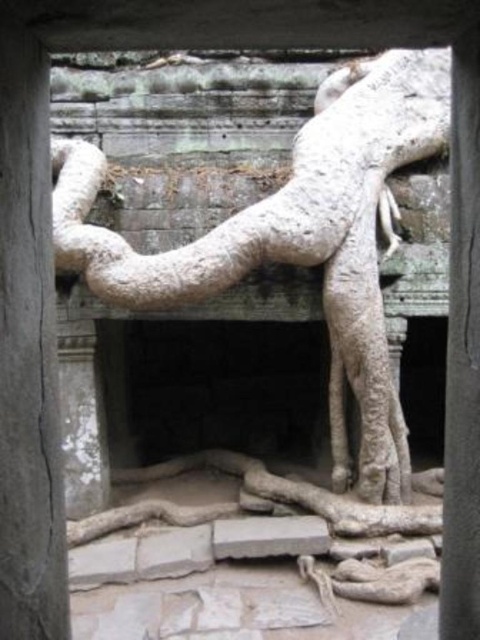
You are an archaeologist standing in front of the stone sculpture. You need to place a protective barrier between the gray stone pillar at center and the smooth stone pillar at center. The barrier must be exactly 4 feet wide. Will the barrier fit between them?

The gray stone pillar at center and smooth stone pillar at center are 4.66 feet apart from each other. Since the barrier is 4 feet wide, it will fit between them with 0.66 feet of space remaining.

You are an architect examining the stone doorway. You see the gray stone pillar at center and the smooth stone pillar at center. Which one is located higher up?

The gray stone pillar at center is above the smooth stone pillar at center, so the gray stone pillar at center is located higher up.

You are an archaeologist examining the stone sculpture. You notice two features in the image. One is the white rough stone roots at upper center and the other is the smooth stone pillar at center. Which of these two features is positioned to the left when viewed from your perspective?

The white rough stone roots at upper center are positioned to the left of the smooth stone pillar at center.